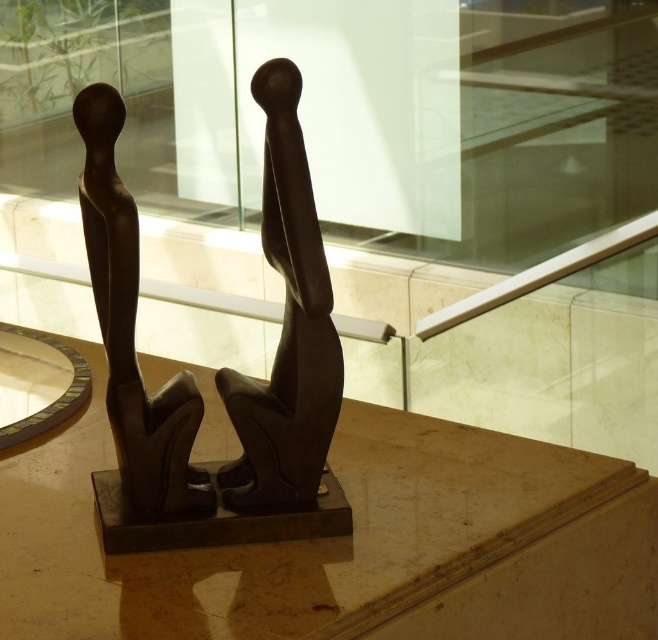
You are an art curator planning to install a spotlight on the matte bronze sculpture at center. The spotlight can only illuminate an area within a 0.3 unit radius from its position. If the spotlight is placed at coordinates point A, which is at position point A, which is at position point A, which is at position point A, which is at position point A, which is at position point A, which is at position point A, which is at position point A, which is at position point A, which is at position point A, which is.

The matte bronze sculpture at center is located at point A, which is at position point A, which is at position point A, which is at position point A, which is at position point A, which is at position point A, which is at position point A, which is at position point A, which is at position point A, which is at position point A, which is. The spotlight needs to be placed within a 0.3 unit radius to effectively illuminate it. Since the sculpture is at point A, you should position the spotlight no more than 0.

You are an art curator planning to install a new light fixture between the two points, point (240, 476) and point (113, 275). Based on their positions, which point should the light fixture be closer to if you want it to illuminate the sculpture behind them more effectively?

Point (240, 476) is behind point (113, 275). To illuminate the sculpture behind them more effectively, the light fixture should be closer to point (240, 476) since it is positioned further back and closer to the sculpture.